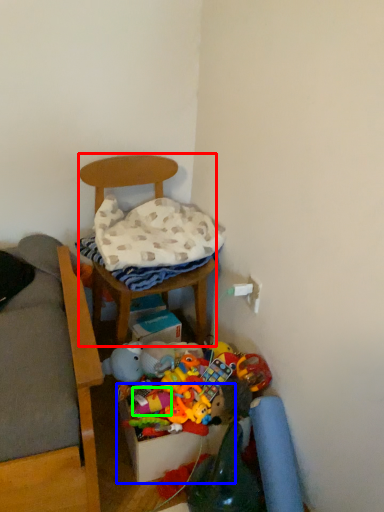
Question: Considering the real-world distances, which object is closest to furniture (highlighted by a red box)? storage box (highlighted by a blue box) or toy (highlighted by a green box).

Choices:
 (A) storage box
 (B) toy

Answer: (B)